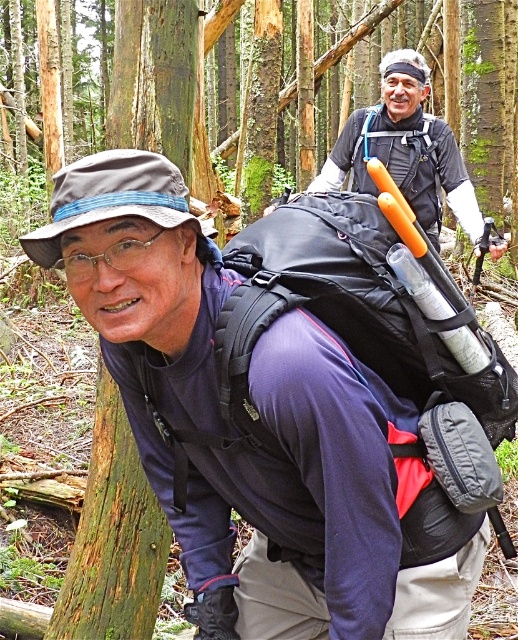
You are a hiker trying to locate your friend who is carrying a matte black backpack at center. You are currently at point (260, 419). Can you see the matte black backpack at center from your current position?

Yes, the matte black backpack at center is located exactly at your current position, so you can see it right in front of you.

You are a hiker navigating through the forest and need to check the position of your matte black backpack at center. According to the coordinates provided, where exactly is it positioned?

The matte black backpack at center is located at point 0.655 on the x axis and 0.502 on the y axis.

You are a hiker trying to locate your backpack in a dense forest. You have two backpacks at the center of your view. Which backpack is closer to you, the matte black backpack at center or the black fabric backpack at center?

The matte black backpack at center is closer to you because it is positioned under the black fabric backpack at center, meaning it is in front of the other one.